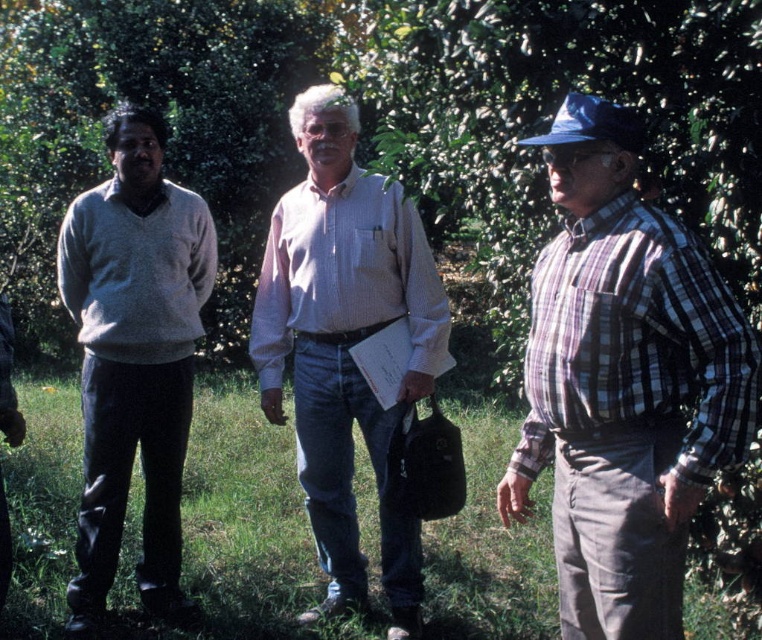
You are a fashion designer observing the plaid cotton shirt at right and the pink striped shirt at center in the image. Which shirt has a narrower width?

The plaid cotton shirt at right is thinner than the pink striped shirt at center, so the plaid cotton shirt at right has a narrower width.